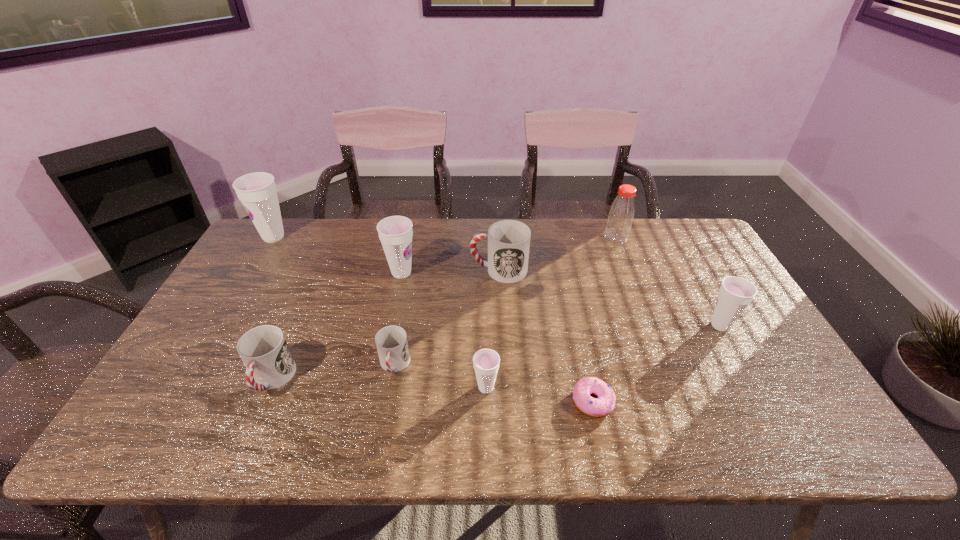
Where is `vacant region between the shortest object and the second cup from left to right`? Image resolution: width=960 pixels, height=540 pixels. vacant region between the shortest object and the second cup from left to right is located at coordinates (432, 390).

At what (x,y) coordinates should I click in order to perform the action: click on unoccupied area between the nearest purple cup and the shortest object. Please return your answer as a coordinate pair (x, y). This screenshot has height=540, width=960. Looking at the image, I should click on (540, 395).

This screenshot has height=540, width=960. I want to click on free space between the shortest object and the bottle, so click(604, 320).

Image resolution: width=960 pixels, height=540 pixels. I want to click on empty space between the third smallest purple cup and the biggest red cup, so click(x=450, y=272).

Locate an element on the screen. free spot between the bottle and the second purple cup from right to left is located at coordinates [551, 313].

Locate an element on the screen. Image resolution: width=960 pixels, height=540 pixels. free space between the nearest purple cup and the second farthest purple cup is located at coordinates (444, 330).

The image size is (960, 540). Identify the location of unoccupied position between the leftmost purple cup and the bottle. (444, 238).

You are a GUI agent. You are given a task and a screenshot of the screen. Output one action in this format:
    pyautogui.click(x=<x>, y=<y>)
    Task: Click on the third closest object to the third purple cup from left to right
    Image resolution: width=960 pixels, height=540 pixels.
    Given the screenshot: What is the action you would take?
    pyautogui.click(x=508, y=240)

Image resolution: width=960 pixels, height=540 pixels. In order to click on the seventh closest object to the third nearest purple cup in this screenshot , I will do `click(622, 210)`.

Image resolution: width=960 pixels, height=540 pixels. I want to click on cup that stands as the second closest to the tallest cup, so click(x=264, y=350).